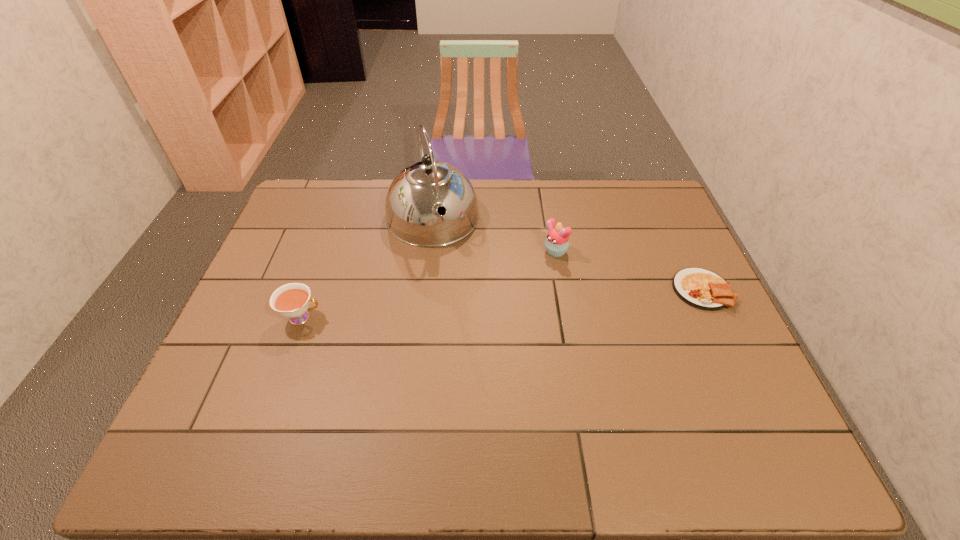
Identify the location of vacant space at the near edge of the desktop. The image size is (960, 540). (500, 385).

In the image, there is a desktop. Where is `blank space at the left edge`? blank space at the left edge is located at coordinates coord(286,348).

In the image, there is a desktop. Identify the location of free space at the right edge. (684, 328).

I want to click on free region at the near right corner of the desktop, so click(x=698, y=396).

Image resolution: width=960 pixels, height=540 pixels. Identify the location of vacant space that's between the rightmost object and the second object from right to left. (628, 272).

Locate an element on the screen. This screenshot has width=960, height=540. free area in between the rightmost object and the third tallest object is located at coordinates (502, 304).

Where is `empty space that is in between the second tallest object and the teacup`? The height and width of the screenshot is (540, 960). empty space that is in between the second tallest object and the teacup is located at coordinates (428, 286).

Locate an element on the screen. Image resolution: width=960 pixels, height=540 pixels. vacant point located between the omelet and the cupcake is located at coordinates (628, 272).

Locate an element on the screen. empty space that is in between the second tallest object and the third object from right to left is located at coordinates (493, 236).

The height and width of the screenshot is (540, 960). In order to click on free space between the second object from right to left and the omelet in this screenshot , I will do `click(628, 272)`.